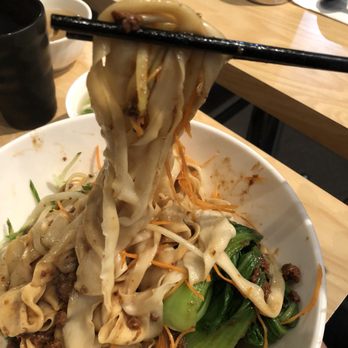
Where is `things found in a kitchen`? Image resolution: width=348 pixels, height=348 pixels. things found in a kitchen is located at coordinates (331, 65), (279, 202), (72, 98), (10, 91), (62, 51), (125, 269).